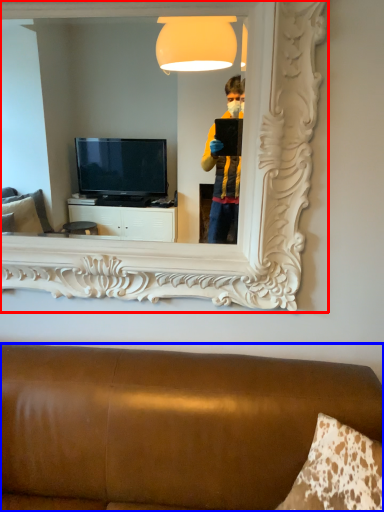
Question: Which of the following is the closest to the observer, mirror (highlighted by a red box) or furniture (highlighted by a blue box)?

Choices:
 (A) mirror
 (B) furniture

Answer: (B)